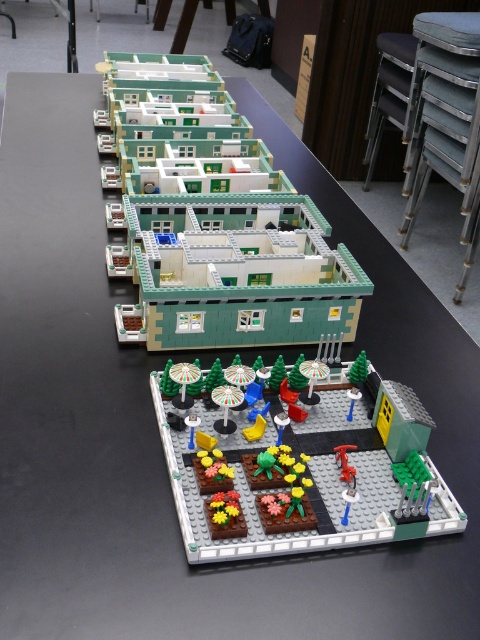
Question: Is green matte building at upper center closer to camera compared to metallic red fire hydrant at center?

Choices:
 (A) yes
 (B) no

Answer: (B)

Question: Which point is farther from the camera taking this photo?

Choices:
 (A) (201, 528)
 (B) (155, 275)
 (C) (340, 461)
 (D) (387, 33)

Answer: (D)

Question: Which of the following is the closest to the observer?

Choices:
 (A) metallic gold stool at upper right
 (B) brick-patterned garden at center
 (C) metallic red fire hydrant at center
 (D) green matte building at upper center

Answer: (B)

Question: Considering the real-world distances, which object is farthest from the metallic red fire hydrant at center?

Choices:
 (A) metallic gold stool at upper right
 (B) brick-patterned garden at center
 (C) green matte building at upper center

Answer: (A)

Question: Does green matte building at upper center come in front of metallic gold stool at upper right?

Choices:
 (A) yes
 (B) no

Answer: (A)

Question: Is green matte building at upper center above brick-patterned garden at center?

Choices:
 (A) no
 (B) yes

Answer: (B)